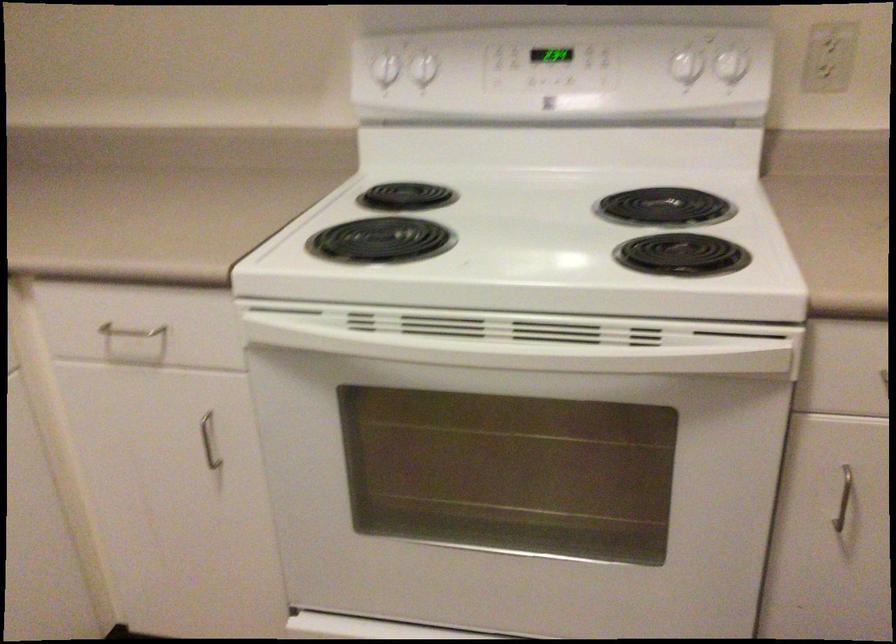
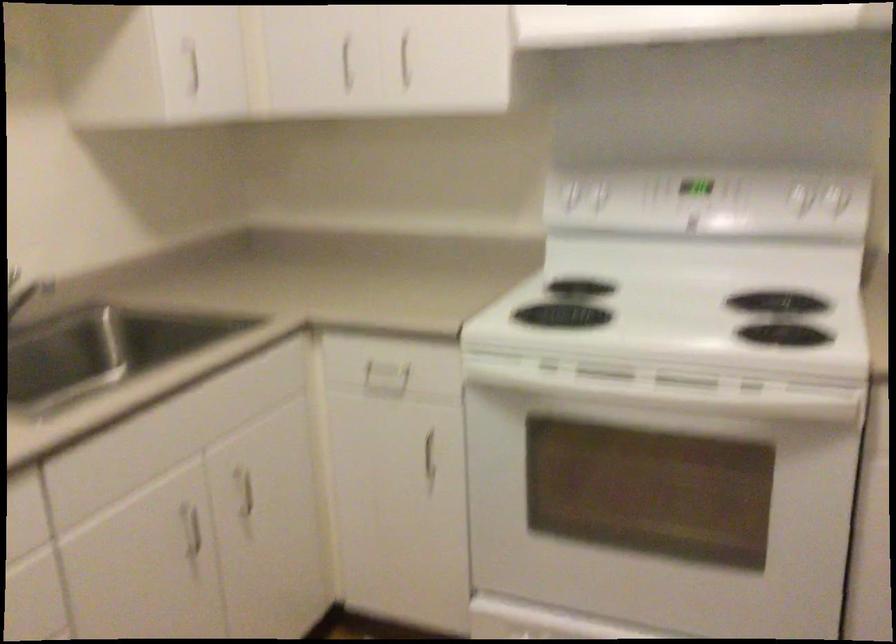
Question: Based on the continuous images, in which direction is the camera rotating? Reply with the corresponding letter.

Choices:
 (A) Left
 (B) Right
 (C) Up
 (D) Down

Answer: (A)